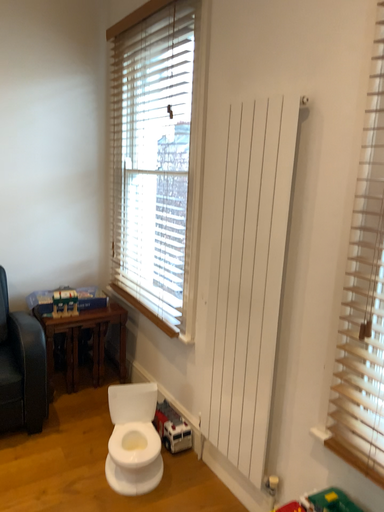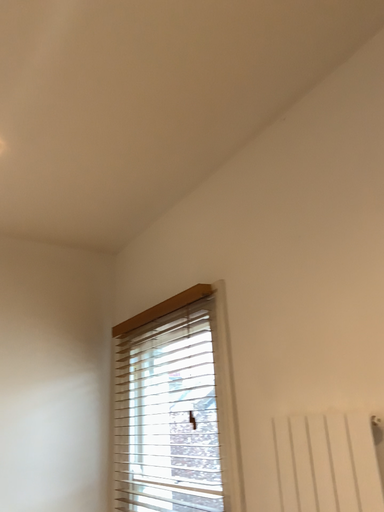
Question: How did the camera likely rotate when shooting the video?

Choices:
 (A) rotated downward
 (B) rotated upward

Answer: (B)